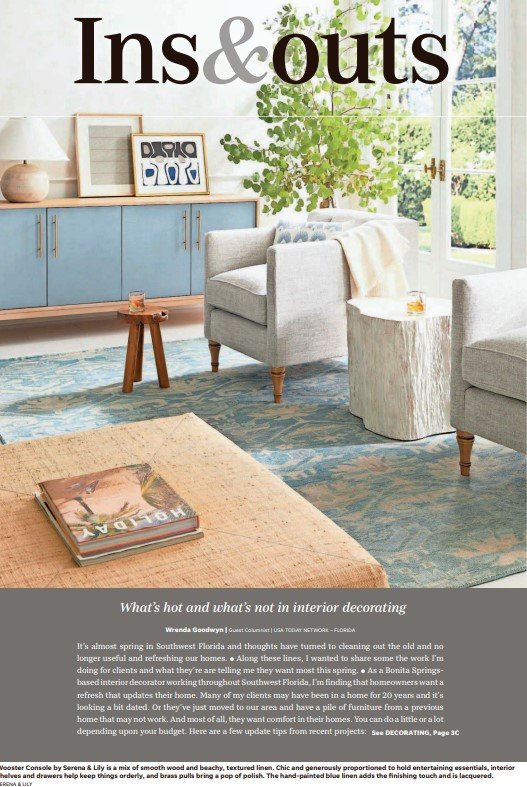
You are a GUI agent. You are given a task and a screenshot of the screen. Output one action in this format:
    pyautogui.click(x=<x>, y=<y>)
    Task: Click on the handles
    The height and width of the screenshot is (787, 527).
    Given the screenshot: What is the action you would take?
    pyautogui.click(x=42, y=234), pyautogui.click(x=54, y=233), pyautogui.click(x=185, y=227), pyautogui.click(x=199, y=220)